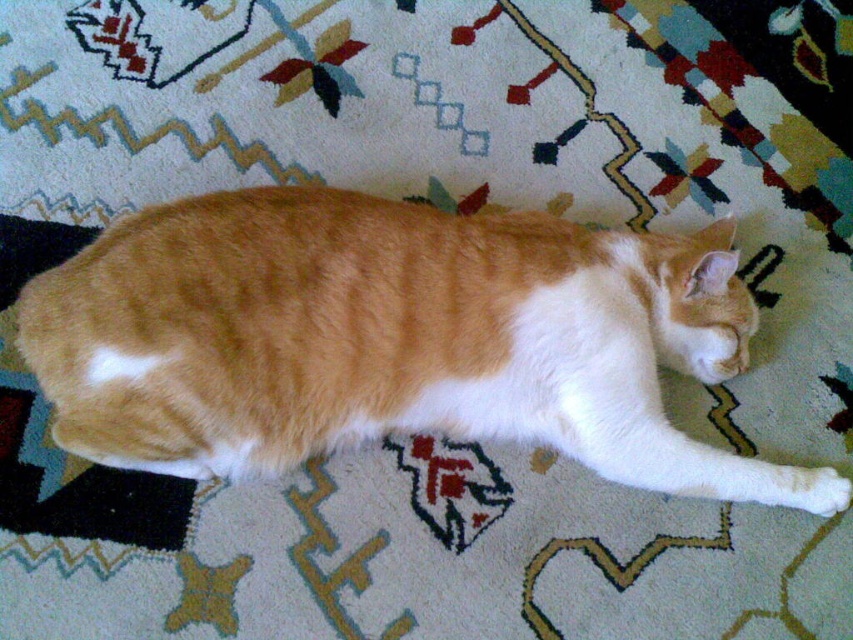
Question: Is orange tabby cat at center wider than white fluffy paw at lower right?

Choices:
 (A) no
 (B) yes

Answer: (B)

Question: Can you confirm if orange tabby cat at center is positioned to the left of white fluffy paw at lower right?

Choices:
 (A) no
 (B) yes

Answer: (B)

Question: Can you confirm if orange tabby cat at center is smaller than white fluffy paw at lower right?

Choices:
 (A) no
 (B) yes

Answer: (A)

Question: Which of the following is the closest to the observer?

Choices:
 (A) white fluffy paw at lower right
 (B) orange tabby cat at center

Answer: (B)

Question: Which object is closer to the camera taking this photo?

Choices:
 (A) white fluffy paw at lower right
 (B) orange tabby cat at center

Answer: (B)